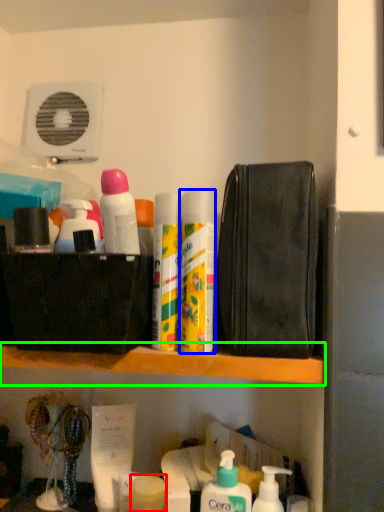
Question: Estimate the real-world distances between objects in this image. Which object is closer to toiletry (highlighted by a red box), cleaning product (highlighted by a blue box) or shelf (highlighted by a green box)?

Choices:
 (A) cleaning product
 (B) shelf

Answer: (B)